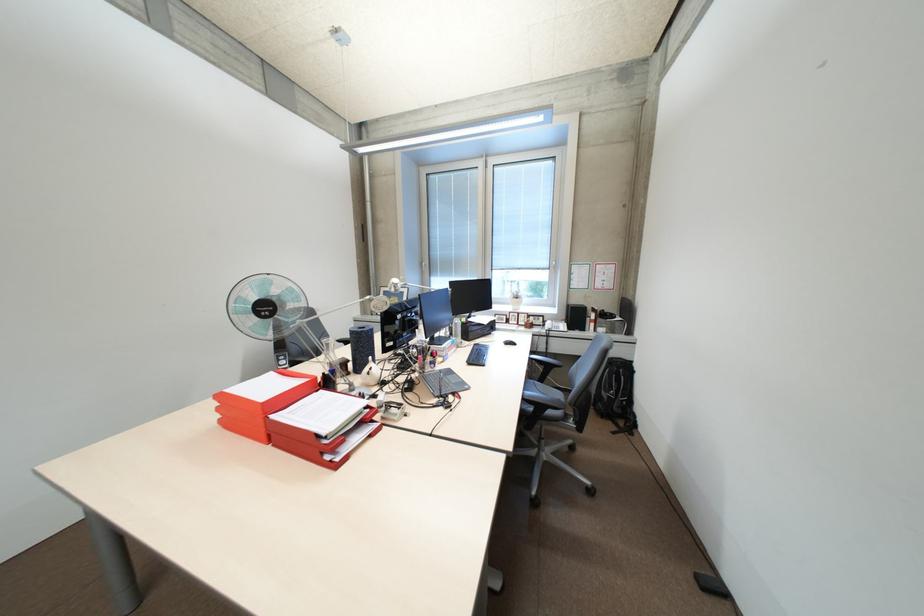
Find where to sit the chair sitting surface. Please return your answer as a coordinate pair (x, y).

(554, 385)